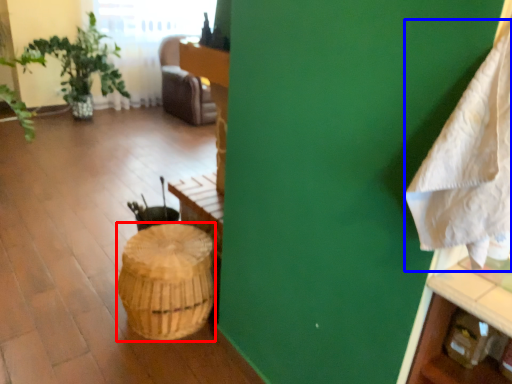
Question: Which point is closer to the camera, basket (highlighted by a red box) or blanket (highlighted by a blue box)?

Choices:
 (A) basket
 (B) blanket

Answer: (B)